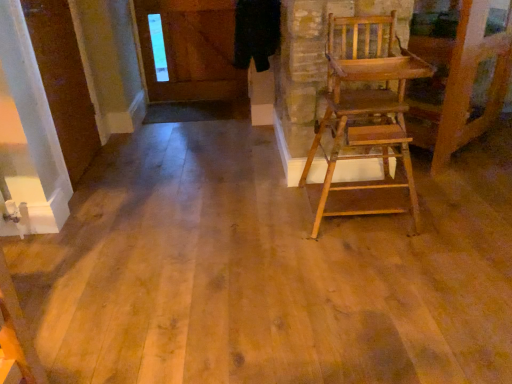
The height and width of the screenshot is (384, 512). What do you see at coordinates (64, 82) in the screenshot?
I see `white glossy door at upper left` at bounding box center [64, 82].

You are a GUI agent. You are given a task and a screenshot of the screen. Output one action in this format:
    pyautogui.click(x=<x>, y=<y>)
    Task: Click on the white glossy door at upper left
    The width and height of the screenshot is (512, 384).
    Given the screenshot: What is the action you would take?
    pyautogui.click(x=64, y=82)

What do you see at coordinates (366, 109) in the screenshot?
I see `wooden high chair at right` at bounding box center [366, 109].

This screenshot has width=512, height=384. In order to click on wooden high chair at right in this screenshot , I will do `click(366, 109)`.

Locate an element on the screen. The height and width of the screenshot is (384, 512). white glossy door at upper left is located at coordinates (64, 82).

Between wooden high chair at right and white glossy door at upper left, which one appears on the right side from the viewer's perspective?

Positioned to the right is wooden high chair at right.

Consider the image. Is the depth of wooden high chair at right less than that of white glossy door at upper left?

Yes, wooden high chair at right is closer to the camera.

Considering the points (359, 32) and (85, 145), which point is behind, point (359, 32) or point (85, 145)?

Point (85, 145)

From the image's perspective, which one is positioned higher, wooden high chair at right or white glossy door at upper left?

white glossy door at upper left is shown above in the image.

In the scene shown: From a real-world perspective, is wooden high chair at right on white glossy door at upper left?

No, from a real-world perspective, wooden high chair at right is not on top of white glossy door at upper left.

Which object is wider, wooden high chair at right or white glossy door at upper left?

wooden high chair at right.

From their relative heights in the image, would you say wooden high chair at right is taller or shorter than white glossy door at upper left?

In the image, wooden high chair at right appears to be shorter than white glossy door at upper left.

Can you confirm if wooden high chair at right is bigger than white glossy door at upper left?

Yes, wooden high chair at right is bigger than white glossy door at upper left.

Is wooden high chair at right located outside white glossy door at upper left?

That's correct, wooden high chair at right is outside of white glossy door at upper left.

Is wooden high chair at right not near white glossy door at upper left?

That's right, there is a large distance between wooden high chair at right and white glossy door at upper left.

Is wooden high chair at right turned away from white glossy door at upper left?

That's not correct — wooden high chair at right is not looking away from white glossy door at upper left.

How many degrees apart are the facing directions of wooden high chair at right and white glossy door at upper left?

There is a 92.9-degree angle between the facing directions of wooden high chair at right and white glossy door at upper left.

I want to click on chair located below the white glossy door at upper left (from the image's perspective), so click(366, 109).

In the scene shown: Which is more to the left, white glossy door at upper left or wooden high chair at right?

From the viewer's perspective, white glossy door at upper left appears more on the left side.

Which is in front, white glossy door at upper left or wooden high chair at right?

wooden high chair at right is in front.

Is point (64, 75) behind point (384, 73)?

Yes.

From the image's perspective, is white glossy door at upper left positioned above or below wooden high chair at right?

Clearly, from the image's perspective, white glossy door at upper left is above wooden high chair at right.

Consider the image. From a real-world perspective, is white glossy door at upper left located beneath wooden high chair at right?

Incorrect, from a real-world perspective, white glossy door at upper left is higher than wooden high chair at right.

Which object is thinner, white glossy door at upper left or wooden high chair at right?

Thinner between the two is white glossy door at upper left.

Can you confirm if white glossy door at upper left is taller than wooden high chair at right?

Yes.

Who is bigger, white glossy door at upper left or wooden high chair at right?

wooden high chair at right is bigger.

Is white glossy door at upper left outside of wooden high chair at right?

Indeed, white glossy door at upper left is completely outside wooden high chair at right.

Are white glossy door at upper left and wooden high chair at right located far from each other?

Yes.

Is white glossy door at upper left looking in the opposite direction of wooden high chair at right?

white glossy door at upper left is not turned away from wooden high chair at right.

Locate an element on the screen. door to the left of wooden high chair at right is located at coordinates (64, 82).

Where is `chair lying in front of the white glossy door at upper left`? Image resolution: width=512 pixels, height=384 pixels. chair lying in front of the white glossy door at upper left is located at coordinates (366, 109).

Image resolution: width=512 pixels, height=384 pixels. Identify the location of chair on the right of white glossy door at upper left. (366, 109).